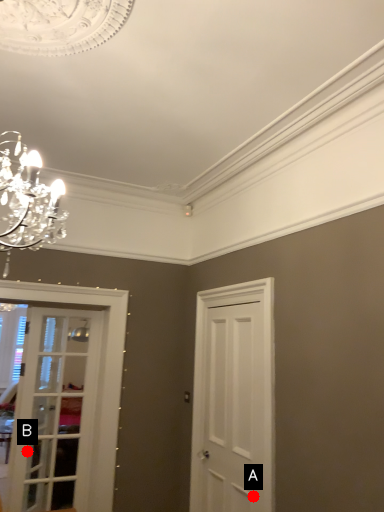
Question: Two points are circled on the image, labeled by A and B beside each circle. Which point is closer to the camera?

Choices:
 (A) A is closer
 (B) B is closer

Answer: (A)